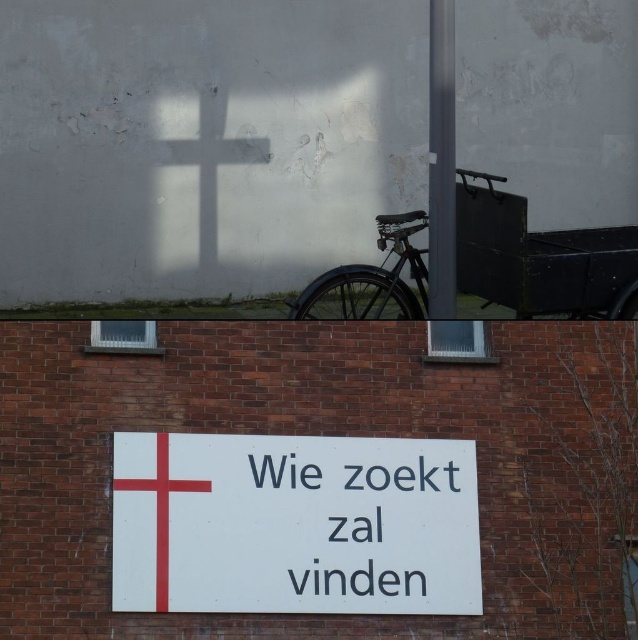
You are a delivery person trying to park your bicycle. The space available is exactly the size of the red painted wooden cross at center. Can your matte black bicycle at center fit into this space?

The matte black bicycle at center is larger in size than the red painted wooden cross at center, so it cannot fit into the space designated for the red painted wooden cross at center.

You are standing 10 meters away from the building facade. Can you safely walk towards the metallic pole at upper right without getting too close?

The metallic pole at upper right is 9.83 meters away from the viewer, so yes, you can safely walk towards it since you are currently 10 meters away and the distance is sufficient.